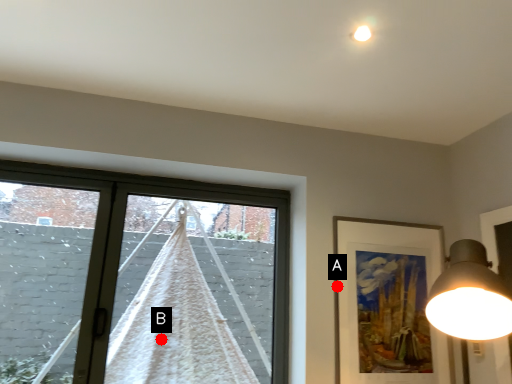
Question: Two points are circled on the image, labeled by A and B beside each circle. Among these points, which one is farthest from the camera?

Choices:
 (A) A is further
 (B) B is further

Answer: (B)